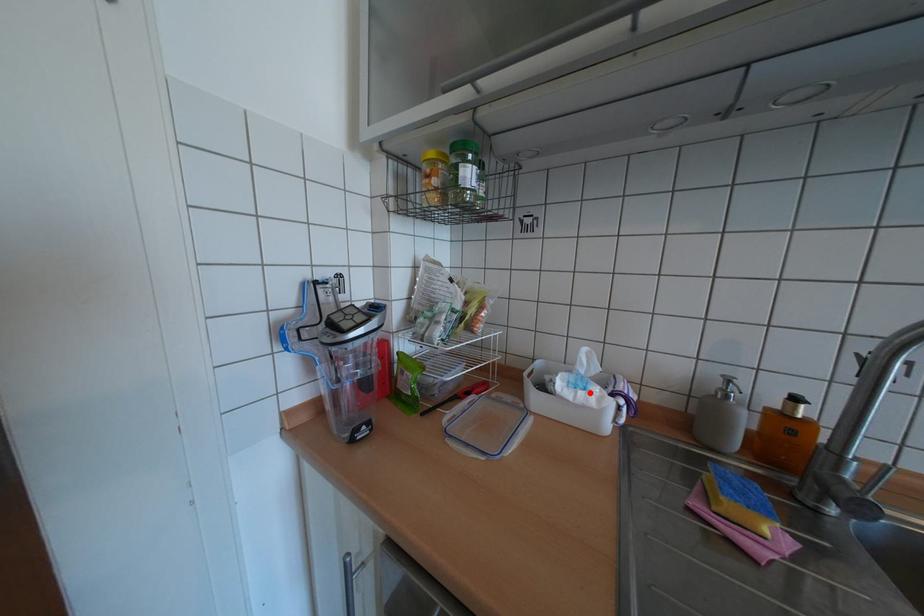
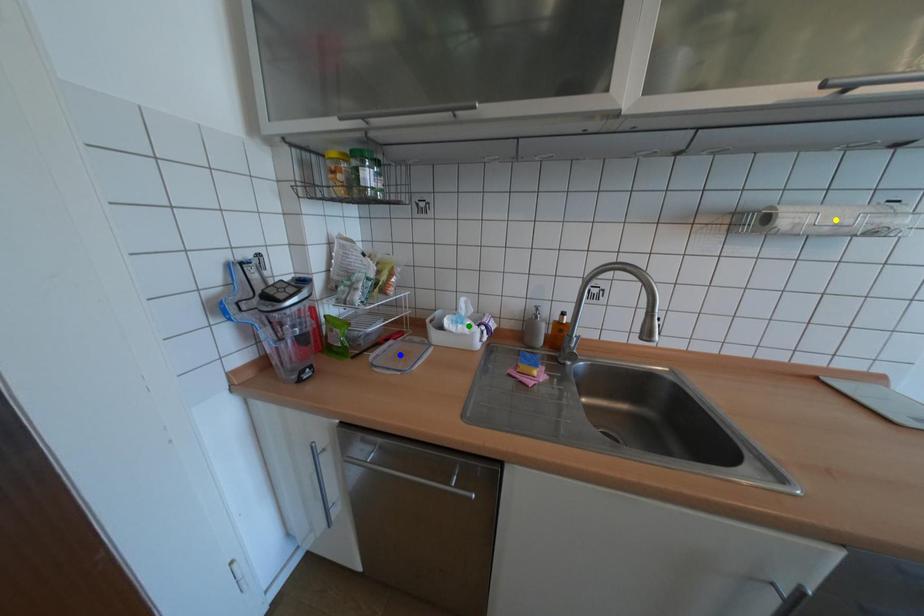
Question: I am providing you with two images of the same scene from different viewpoints. A red point is marked on the first image. You are given multiple points on the second image. Can you choose the point in image 2 that corresponds to the point in image 1?

Choices:
 (A) green point
 (B) blue point
 (C) yellow point

Answer: (A)